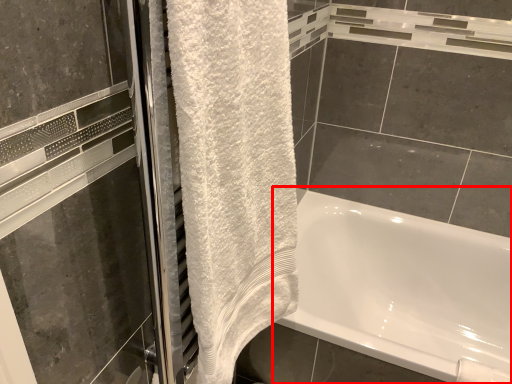
Question: From the image's perspective, where is bathtub (annotated by the red box) located in relation to towel in the image?

Choices:
 (A) below
 (B) above

Answer: (A)